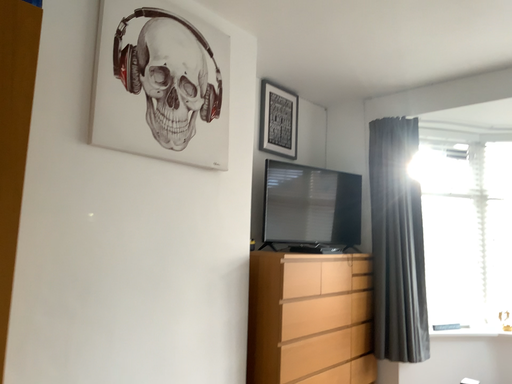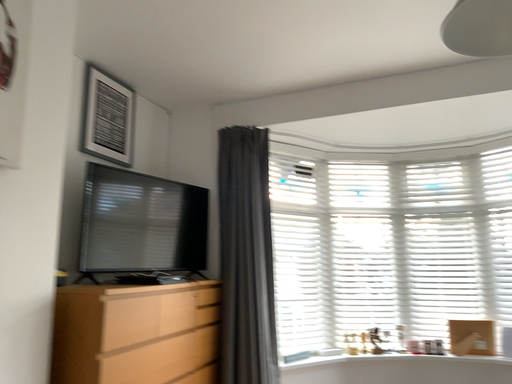
Question: How did the camera likely rotate when shooting the video?

Choices:
 (A) rotated left
 (B) rotated right

Answer: (B)